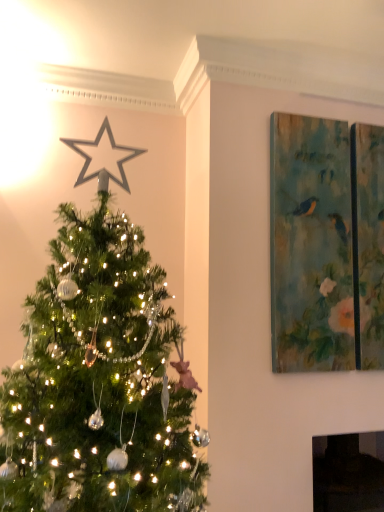
I want to click on textured canvas painting at upper right, so click(326, 244).

The width and height of the screenshot is (384, 512). Describe the element at coordinates (326, 244) in the screenshot. I see `textured canvas painting at upper right` at that location.

What is the approximate height of textured canvas painting at upper right?

textured canvas painting at upper right is 36.65 inches tall.

I want to click on textured canvas painting at upper right, so click(x=326, y=244).